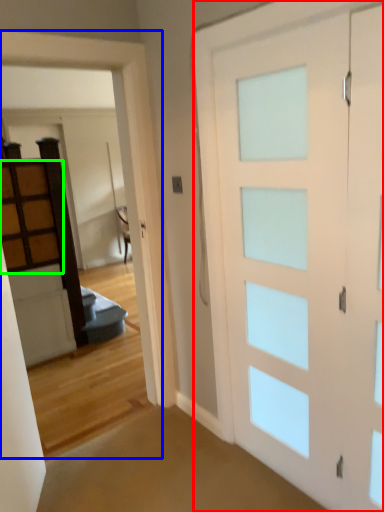
Question: Which object is positioned closest to barn door (highlighted by a red box)? Select from garage door (highlighted by a blue box) and cabinetry (highlighted by a green box).

Choices:
 (A) garage door
 (B) cabinetry

Answer: (A)